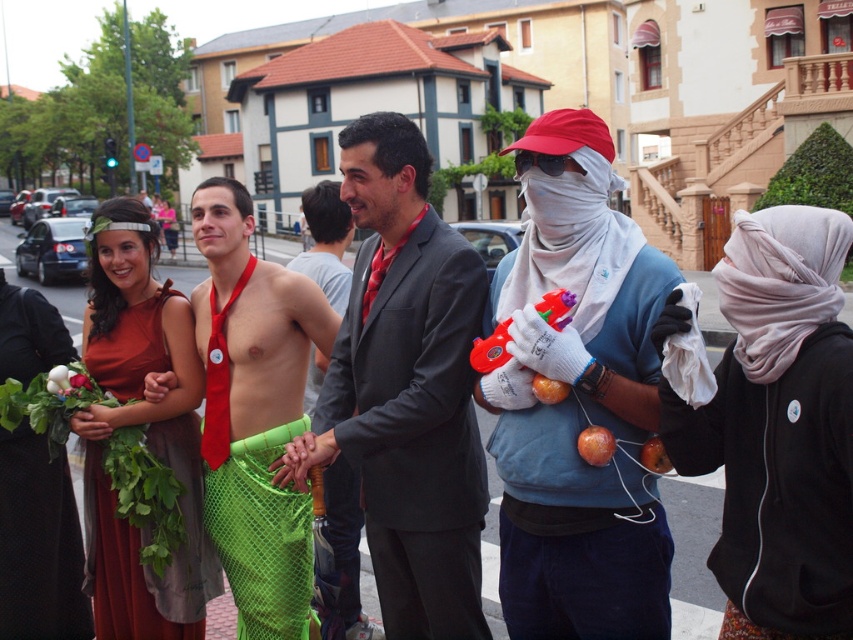
You are a photographer standing in the street scene and want to take a photo of both the green netting dress at left and the orange matte apple at center. Which object should you focus on first to ensure both are in sharp focus?

To ensure both the green netting dress at left and the orange matte apple at center are in sharp focus, you should focus on the green netting dress at left first since it is closer to you than the orange matte apple at center. This way, the depth of field will cover both objects effectively.